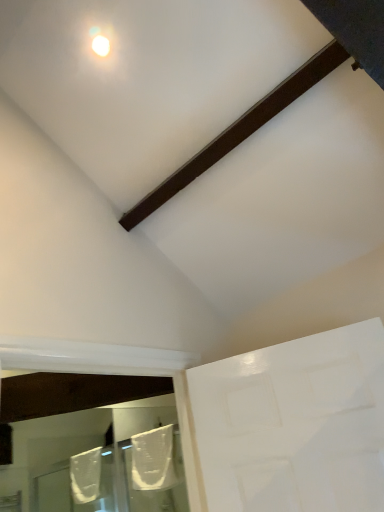
What is the approximate height of white matte towel at lower center?

17.70 inches.

Describe the element at coordinates (150, 459) in the screenshot. I see `white matte towel at lower center` at that location.

In order to click on white matte towel at lower center in this screenshot , I will do `click(150, 459)`.

Identify the location of white matte towel at lower center. This screenshot has width=384, height=512. (150, 459).